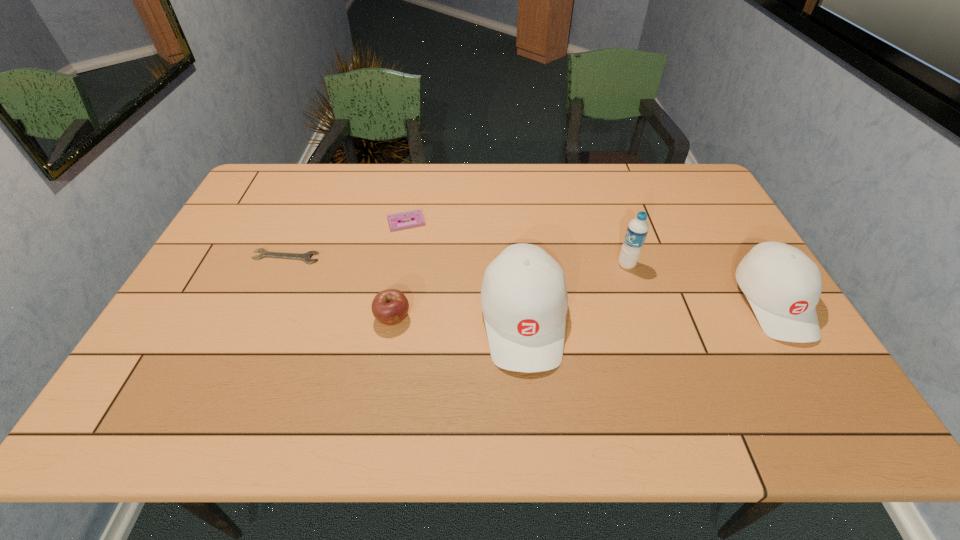
This screenshot has width=960, height=540. What are the coordinates of `vacant region located 0.100m on the front-facing side of the right baseball cap` in the screenshot? It's located at (822, 383).

Find the location of `free space located on the left of the videotape`. free space located on the left of the videotape is located at coordinates (332, 222).

I want to click on vacant space located on the label of the water bottle, so click(x=564, y=265).

At what (x,y) coordinates should I click in order to perform the action: click on blank space located on the label of the water bottle. Please return your answer as a coordinate pair (x, y). This screenshot has width=960, height=540. Looking at the image, I should click on (508, 265).

Where is `free spot located 0.240m on the label of the water bottle`? The height and width of the screenshot is (540, 960). free spot located 0.240m on the label of the water bottle is located at coordinates (533, 265).

This screenshot has width=960, height=540. I want to click on free region located 0.170m on the right of the leftmost object, so click(378, 257).

Find the location of `vacant space situated on the side of the apple with the unique marking`. vacant space situated on the side of the apple with the unique marking is located at coordinates (388, 349).

Identify the location of object at the near edge. (524, 300).

Image resolution: width=960 pixels, height=540 pixels. What are the coordinates of `object situated at the left edge` in the screenshot? It's located at (306, 257).

At what (x,y) coordinates should I click in order to perform the action: click on object at the right edge. Please return your answer as a coordinate pair (x, y). The width and height of the screenshot is (960, 540). Looking at the image, I should click on tap(783, 285).